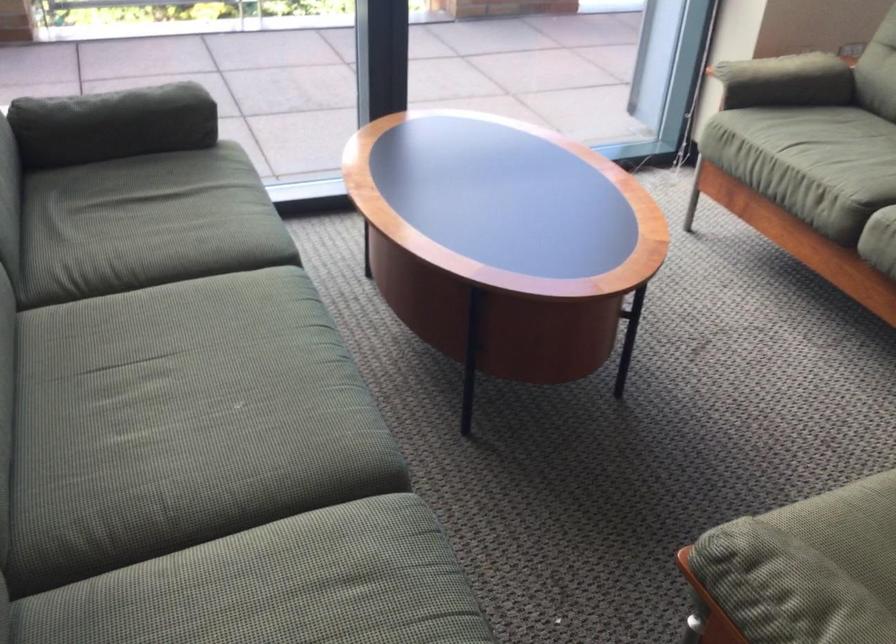
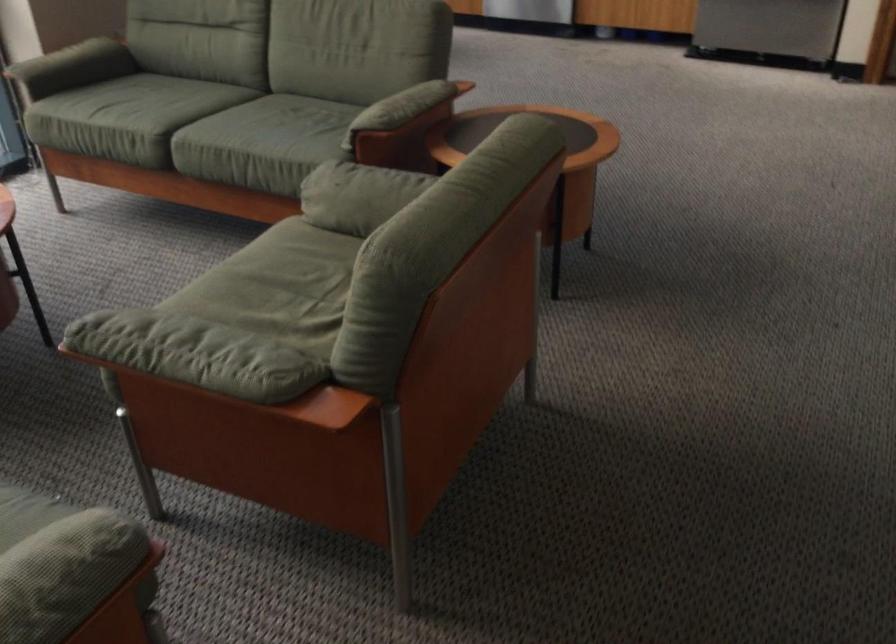
Question: The first image is from the beginning of the video and the second image is from the end. How did the camera likely rotate when shooting the video?

Choices:
 (A) Left
 (B) Right
 (C) Up
 (D) Down

Answer: (B)